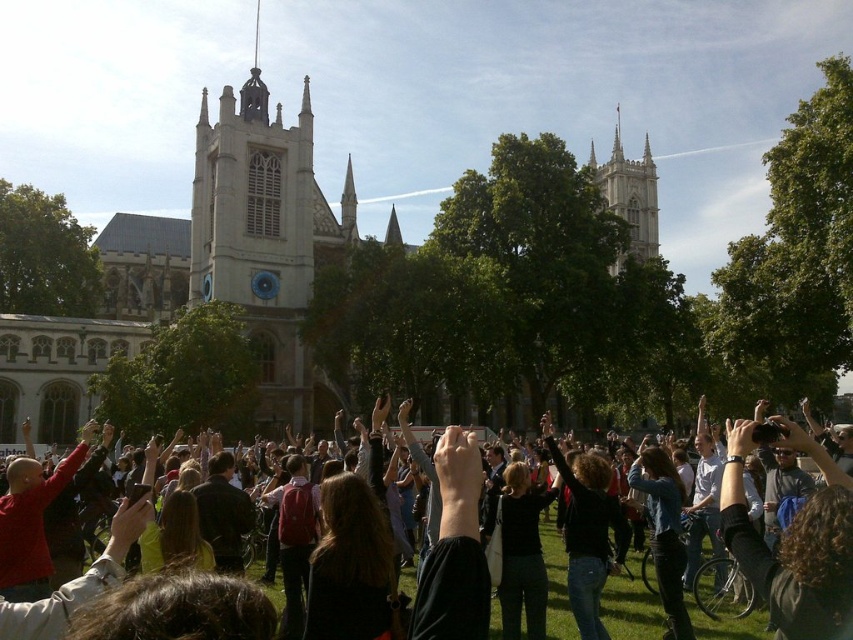
Does dark brown leather jacket at center have a smaller size compared to black fabric at center?

Actually, dark brown leather jacket at center might be larger than black fabric at center.

Does dark brown leather jacket at center appear on the left side of black fabric at center?

In fact, dark brown leather jacket at center is to the right of black fabric at center.

Is point (839, 609) more distant than point (596, 541)?

No, it is not.

In order to click on dark brown leather jacket at center in this screenshot , I will do `click(793, 541)`.

Does point (432, 580) lie behind point (577, 589)?

No.

Between point (457, 490) and point (570, 506), which one is positioned behind?

Point (570, 506)

The image size is (853, 640). What are the coordinates of `dark brown hair at center` in the screenshot? It's located at (456, 541).

Is stone church at center taller than dark brown leather jacket at center?

Yes.

Is point (457, 68) less distant than point (802, 440)?

No.

Does point (219, 257) come farther from viewer compared to point (830, 556)?

Yes, it is.

Identify the location of stone church at center. (285, 129).